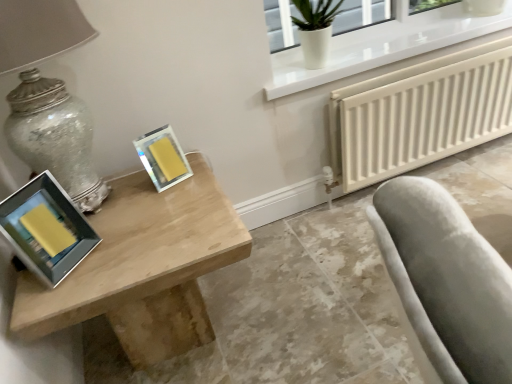
Where is `free space that is in between matte glass table lamp at left and matte yellow picture frame at left, marked as the 2th picture frame in a right-to-left arrangement`? The width and height of the screenshot is (512, 384). free space that is in between matte glass table lamp at left and matte yellow picture frame at left, marked as the 2th picture frame in a right-to-left arrangement is located at coordinates (114, 241).